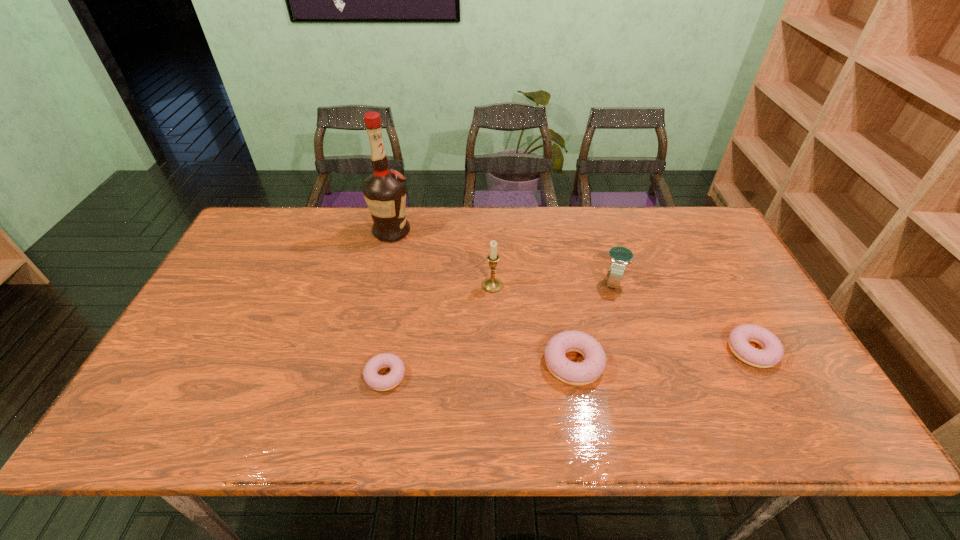
Locate an element on the screen. The image size is (960, 540). vacant area that satisfies the following two spatial constraints: 1. on the front and back of the farthest object; 2. on the left side of the watch is located at coordinates (380, 282).

Image resolution: width=960 pixels, height=540 pixels. Find the location of `vacant space that satisfies the following two spatial constraints: 1. on the front and back of the tallest object; 2. on the back side of the fourth shortest object`. vacant space that satisfies the following two spatial constraints: 1. on the front and back of the tallest object; 2. on the back side of the fourth shortest object is located at coordinates click(x=380, y=282).